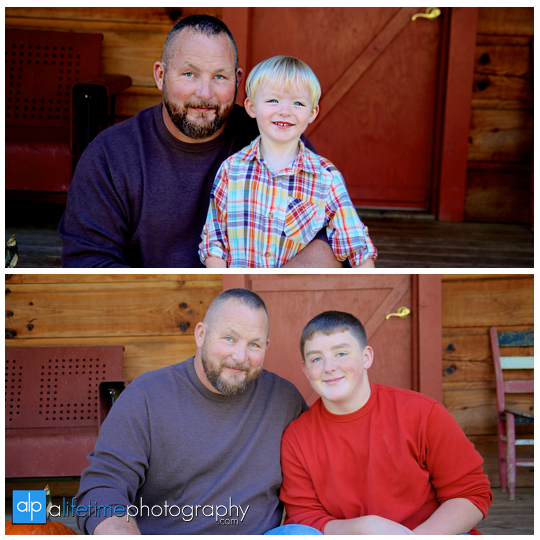
I want to click on red painted wooden door, so pyautogui.click(x=411, y=98), pyautogui.click(x=397, y=360).